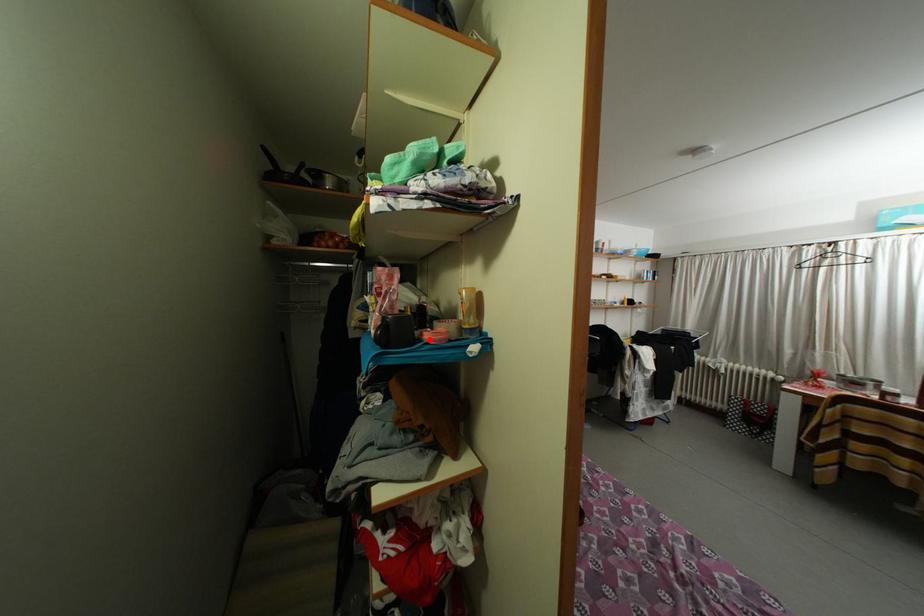
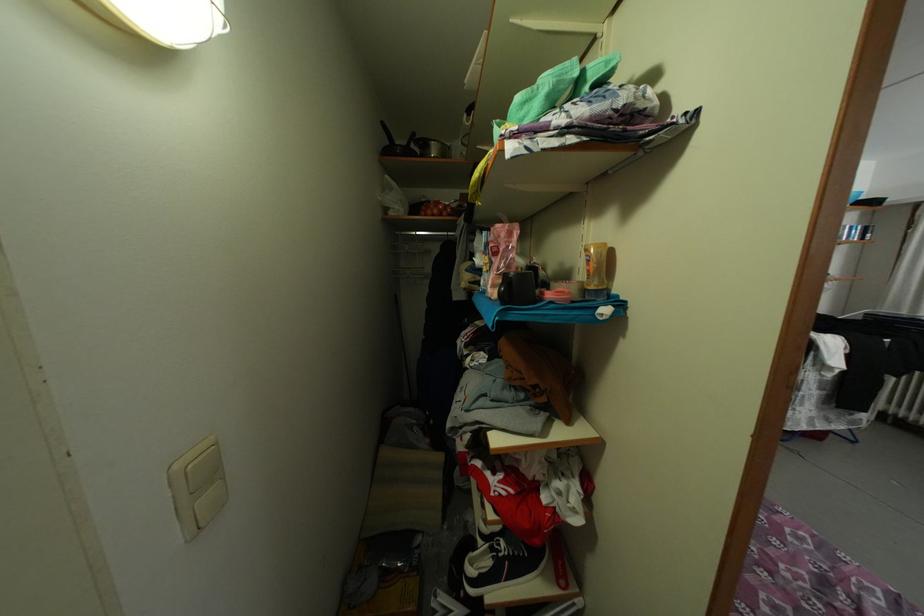
Question: I am providing you with two images of the same scene from different viewpoints. A red point is marked on the first image. At the location where the point appears in image 1, is it still visible in image 2?

Choices:
 (A) Yes
 (B) No

Answer: (A)